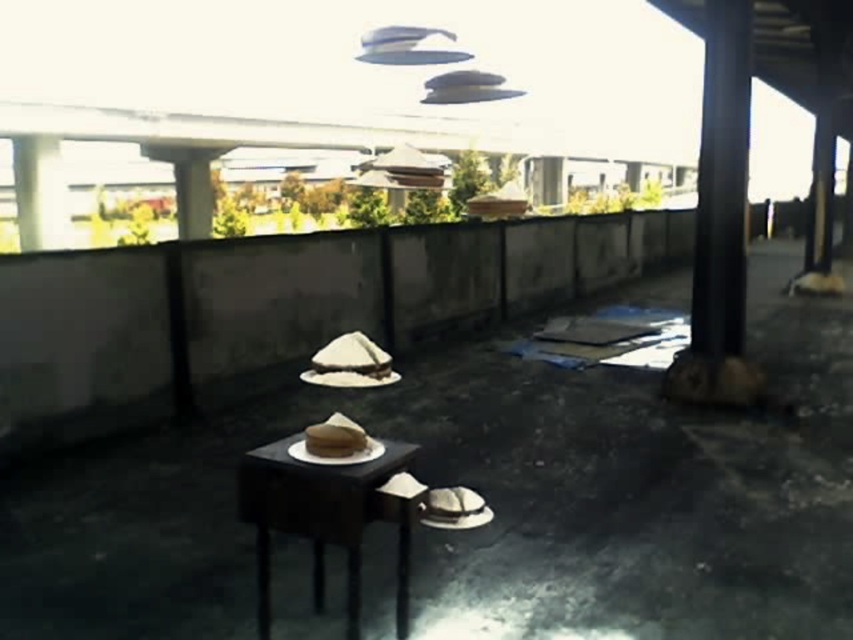
Which is above, matte black table at center or brown matte cowboy hat at lower center?

brown matte cowboy hat at lower center is higher up.

What do you see at coordinates (326, 516) in the screenshot? I see `matte black table at center` at bounding box center [326, 516].

Which is behind, point (341, 545) or point (444, 516)?

The point (444, 516) is more distant.

This screenshot has height=640, width=853. I want to click on matte black table at center, so click(326, 516).